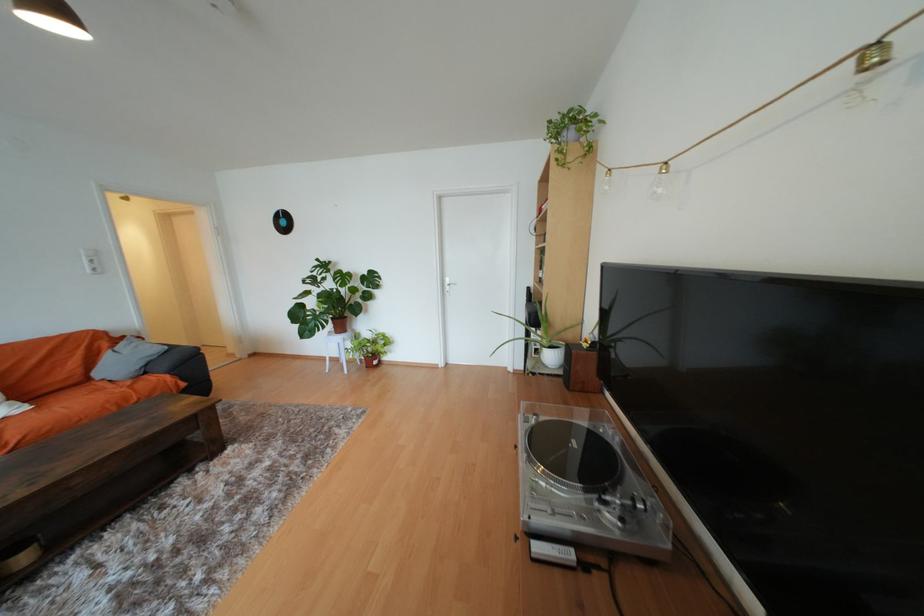
This screenshot has width=924, height=616. What are the coordinates of `silver door handle` in the screenshot? It's located at (446, 285).